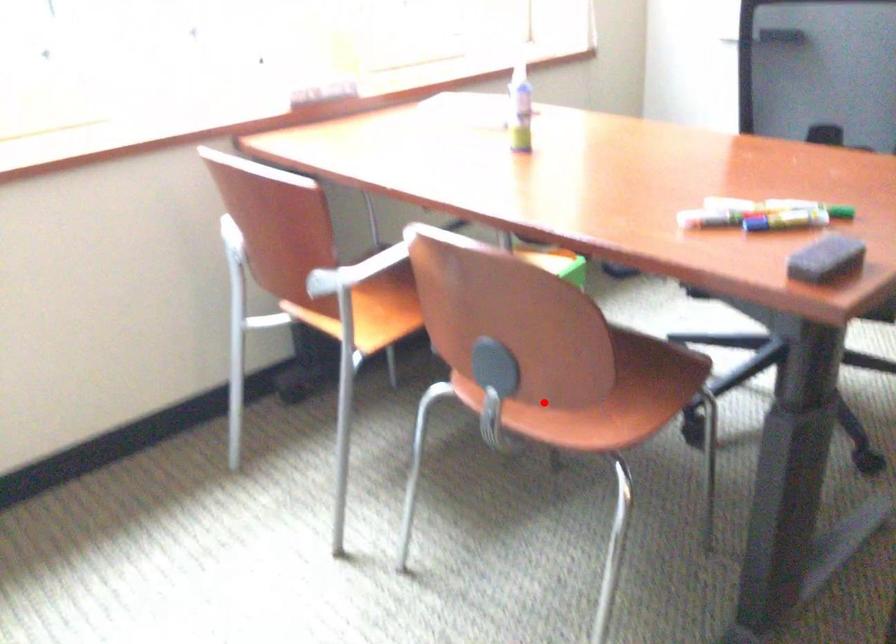
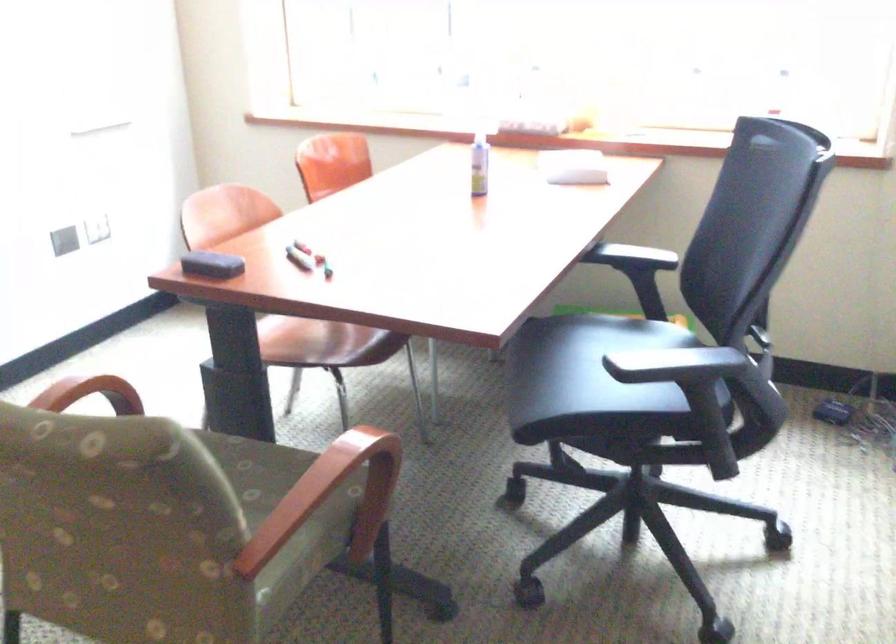
Question: A red point is marked in image1. In image2, is the corresponding 3D point closer to the camera or farther? Reply with the corresponding letter.

Choices:
 (A) The corresponding 3D point is closer.
 (B) The corresponding 3D point is farther.

Answer: (B)